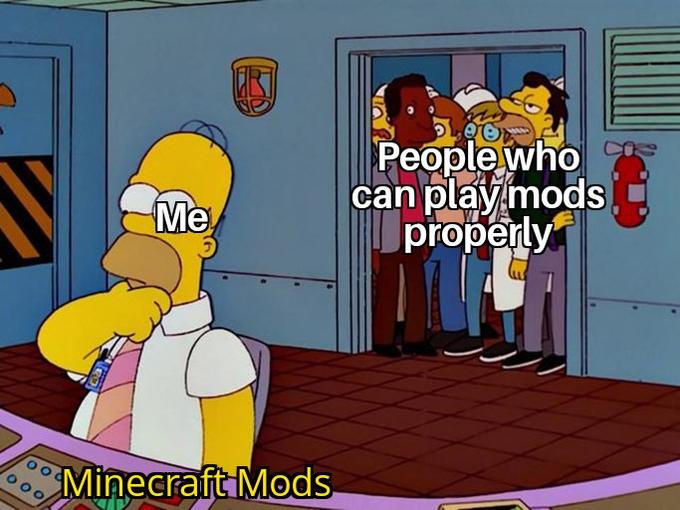
You are a GUI agent. You are given a task and a screenshot of the screen. Output one action in this format:
    pyautogui.click(x=<x>, y=<y>)
    Task: Click on the vent
    The width and height of the screenshot is (680, 510).
    Given the screenshot: What is the action you would take?
    pyautogui.click(x=647, y=93)